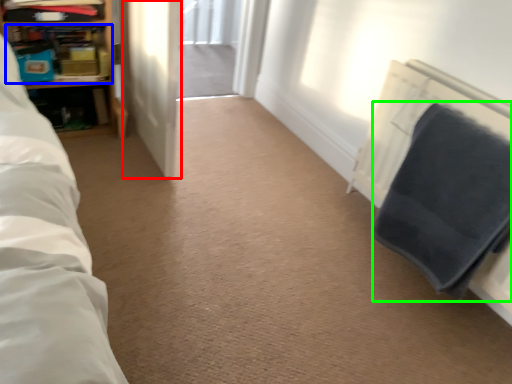
Question: Which object is positioned farthest from screen door (highlighted by a red box)? Select from shelf (highlighted by a blue box) and blanket (highlighted by a green box).

Choices:
 (A) shelf
 (B) blanket

Answer: (B)